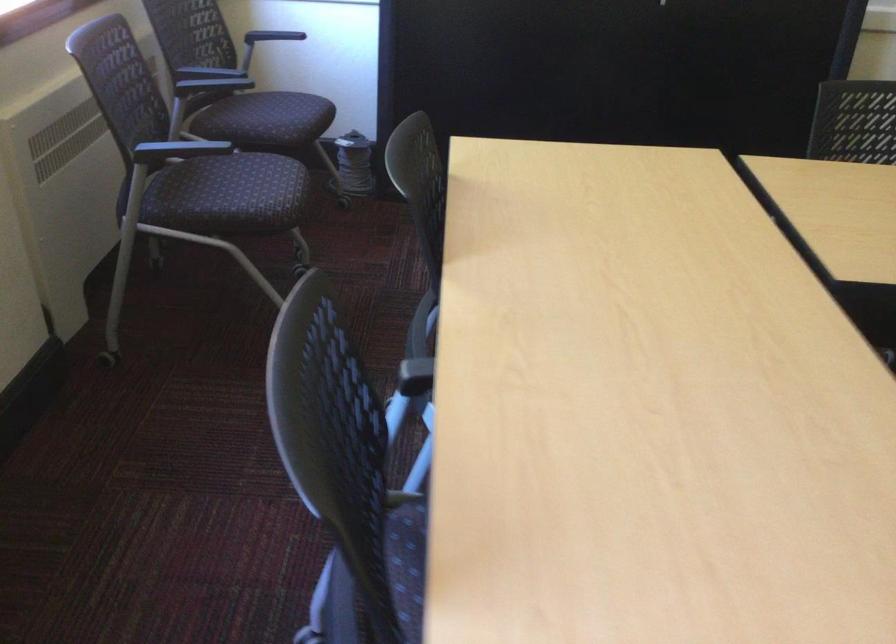
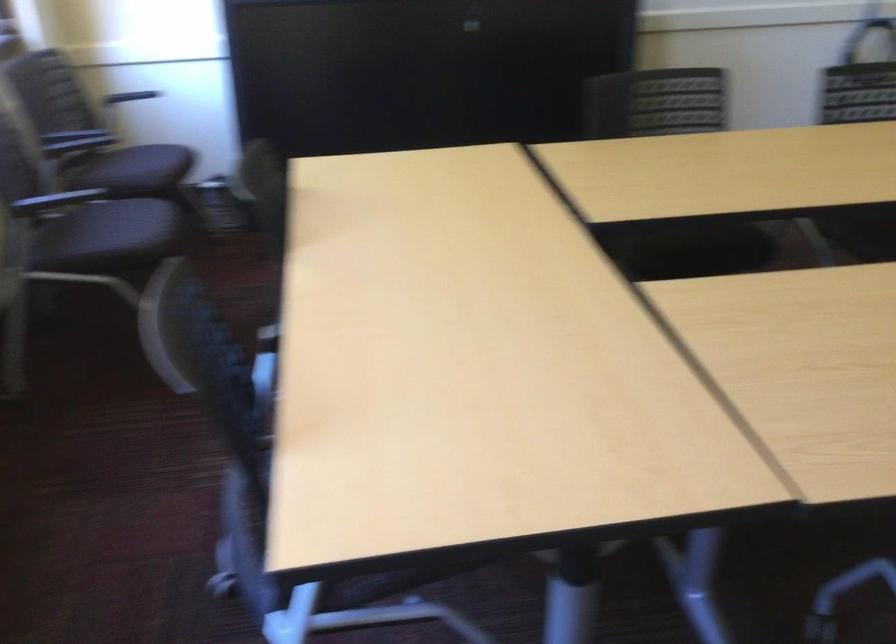
In the second image, find the point that corresponds to (240,192) in the first image.

(116, 234)